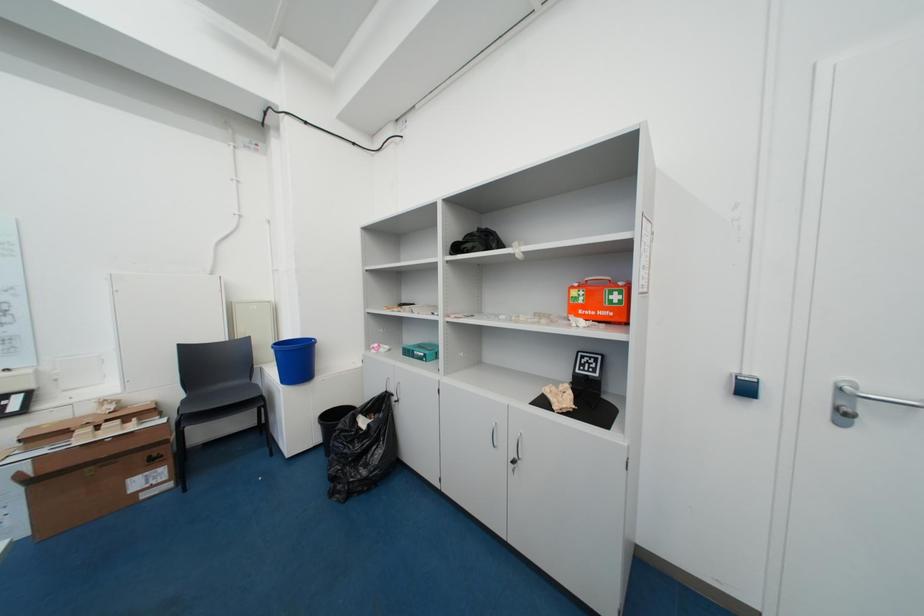
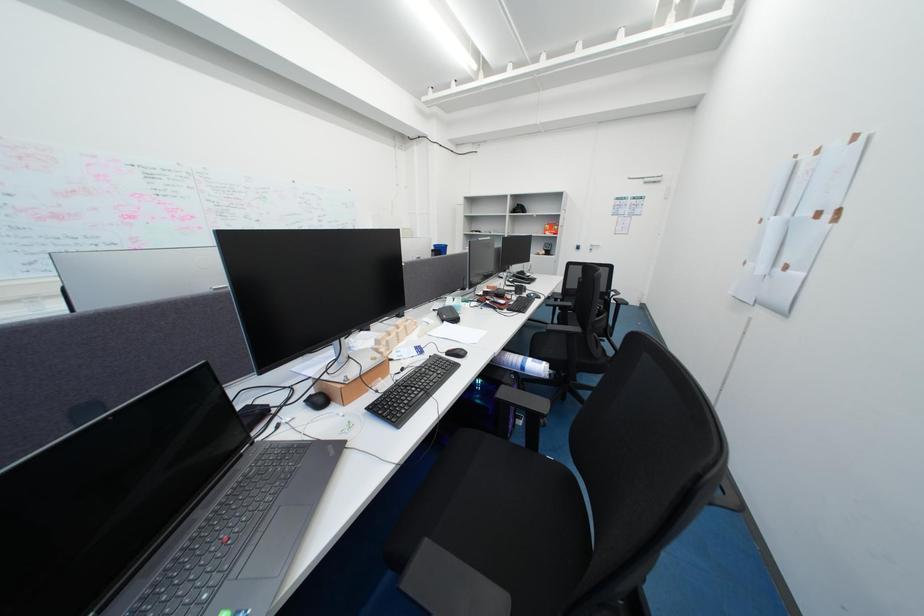
Consider the image. Which direction would the cameraman need to move to produce the second image?

The movement direction of the cameraman is left, backward.